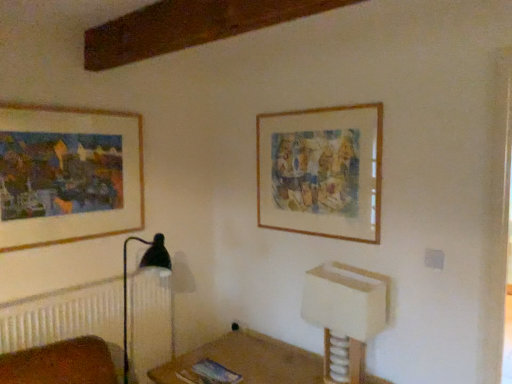
Question: Considering the relative sizes of wooden frame at upper right, arranged as the 1th picture frame when viewed from the right, and white plastic vanity at lower right in the image provided, is wooden frame at upper right, arranged as the 1th picture frame when viewed from the right, bigger than white plastic vanity at lower right?

Choices:
 (A) no
 (B) yes

Answer: (A)

Question: Is wooden frame at upper right, arranged as the 1th picture frame when viewed from the right, at the right side of white plastic vanity at lower right?

Choices:
 (A) no
 (B) yes

Answer: (A)

Question: From the image's perspective, is wooden frame at upper right, arranged as the 2th picture frame when viewed from the left, on white plastic vanity at lower right?

Choices:
 (A) no
 (B) yes

Answer: (B)

Question: Considering the relative sizes of wooden frame at upper right, arranged as the 2th picture frame when viewed from the left, and white plastic vanity at lower right in the image provided, is wooden frame at upper right, arranged as the 2th picture frame when viewed from the left, shorter than white plastic vanity at lower right?

Choices:
 (A) no
 (B) yes

Answer: (A)

Question: Is white plastic vanity at lower right surrounded by wooden frame at upper right, arranged as the 2th picture frame when viewed from the left?

Choices:
 (A) yes
 (B) no

Answer: (B)

Question: From a real-world perspective, does wooden frame at upper right, arranged as the 1th picture frame when viewed from the right, stand above white plastic vanity at lower right?

Choices:
 (A) yes
 (B) no

Answer: (A)

Question: Would you say wooden picture frame at upper left, arranged as the first picture frame when viewed from the left, is a long distance from wooden frame at upper right, arranged as the 1th picture frame when viewed from the right?

Choices:
 (A) yes
 (B) no

Answer: (A)

Question: Is wooden picture frame at upper left, which appears as the 2th picture frame when viewed from the right, further to camera compared to wooden frame at upper right, arranged as the 1th picture frame when viewed from the right?

Choices:
 (A) no
 (B) yes

Answer: (A)

Question: Considering the relative positions of wooden picture frame at upper left, which appears as the 2th picture frame when viewed from the right, and wooden frame at upper right, arranged as the 1th picture frame when viewed from the right, in the image provided, is wooden picture frame at upper left, which appears as the 2th picture frame when viewed from the right, to the right of wooden frame at upper right, arranged as the 1th picture frame when viewed from the right, from the viewer's perspective?

Choices:
 (A) yes
 (B) no

Answer: (B)

Question: Can you confirm if wooden picture frame at upper left, which appears as the 2th picture frame when viewed from the right, is taller than wooden frame at upper right, arranged as the 2th picture frame when viewed from the left?

Choices:
 (A) yes
 (B) no

Answer: (B)

Question: Is wooden picture frame at upper left, arranged as the first picture frame when viewed from the left, positioned before wooden frame at upper right, arranged as the 2th picture frame when viewed from the left?

Choices:
 (A) no
 (B) yes

Answer: (B)

Question: Can you confirm if wooden picture frame at upper left, arranged as the first picture frame when viewed from the left, is shorter than wooden frame at upper right, arranged as the 2th picture frame when viewed from the left?

Choices:
 (A) yes
 (B) no

Answer: (A)

Question: Does white plastic vanity at lower right have a smaller size compared to wooden picture frame at upper left, which appears as the 2th picture frame when viewed from the right?

Choices:
 (A) no
 (B) yes

Answer: (A)